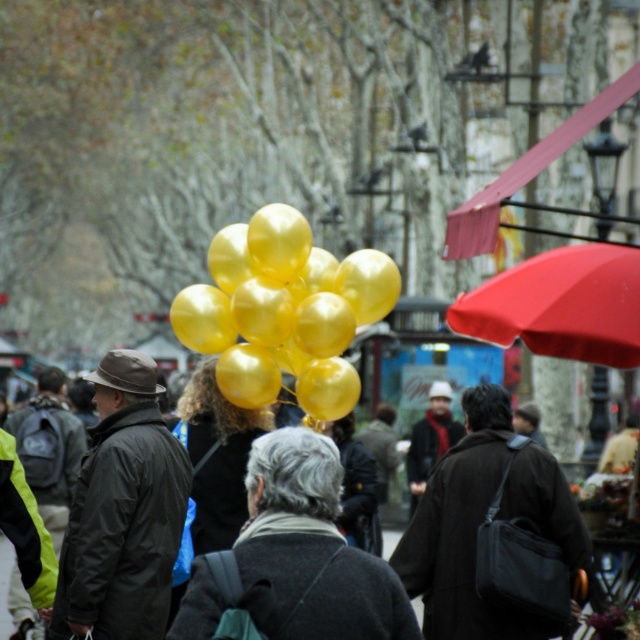
You are a photographer standing at the camera position. You want to take a closeup shot of the metallic gold balloons at center. Considering the distance between you and the balloons, can you use a standard zoom lens with a maximum focal length of 50mm to achieve this without moving closer? Explain your reasoning.

The metallic gold balloons at center are 47.85 meters away from the camera. A standard zoom lens with a maximum focal length of 50mm typically has a limited reach, making it difficult to capture a closeup of an object at that distance without moving closer. Therefore, it would not be feasible to achieve a closeup with this lens under these conditions.

You are a photographer trying to capture the metallic gold balloons at center and the red matte umbrella at upper right in the same frame. Based on their sizes in the image, which object would appear closer to the camera?

The metallic gold balloons at center appear closer to the camera because they are smaller in the image compared to the red matte umbrella at upper right. In photography, objects that are smaller in the frame typically appear farther away, but since the description states the balloons are smaller, they might actually be closer if they are physically smaller objects. Wait, there might be confusion here. Let me clarify based on the given description.